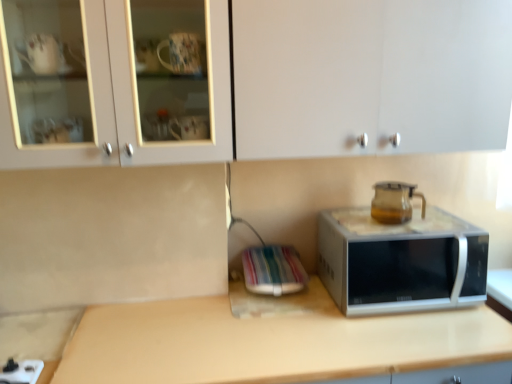
The image size is (512, 384). Identify the location of unoccupied space behind transparent glass coffeepot at upper right. (x=388, y=218).